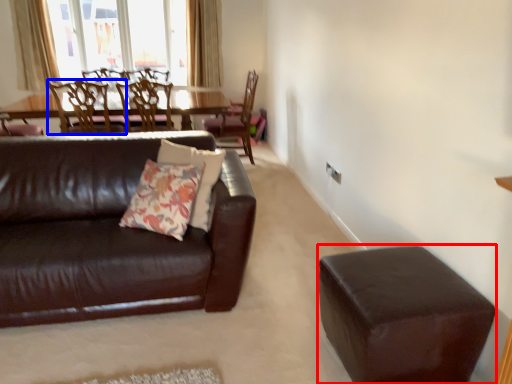
Question: Which point is closer to the camera, stool (highlighted by a red box) or chair (highlighted by a blue box)?

Choices:
 (A) stool
 (B) chair

Answer: (A)